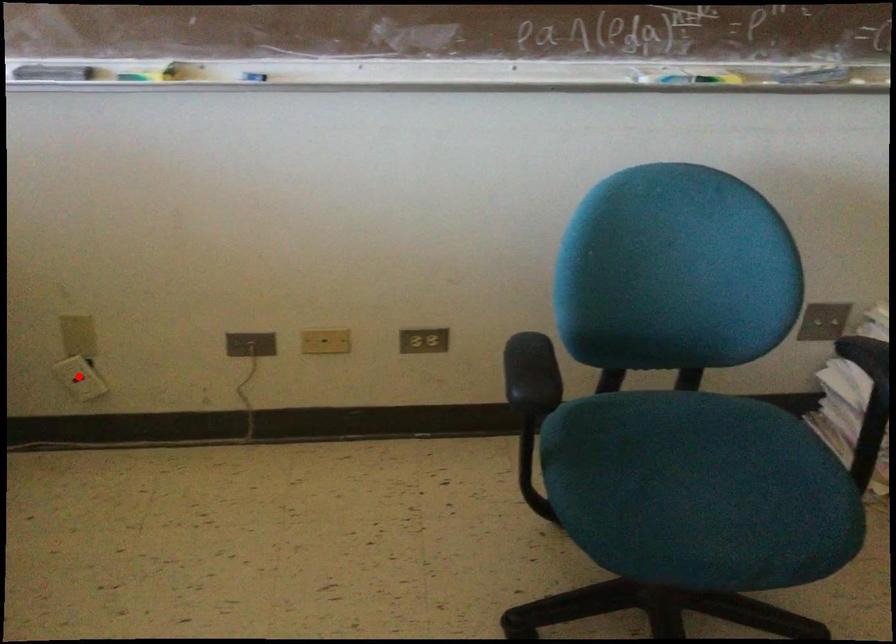
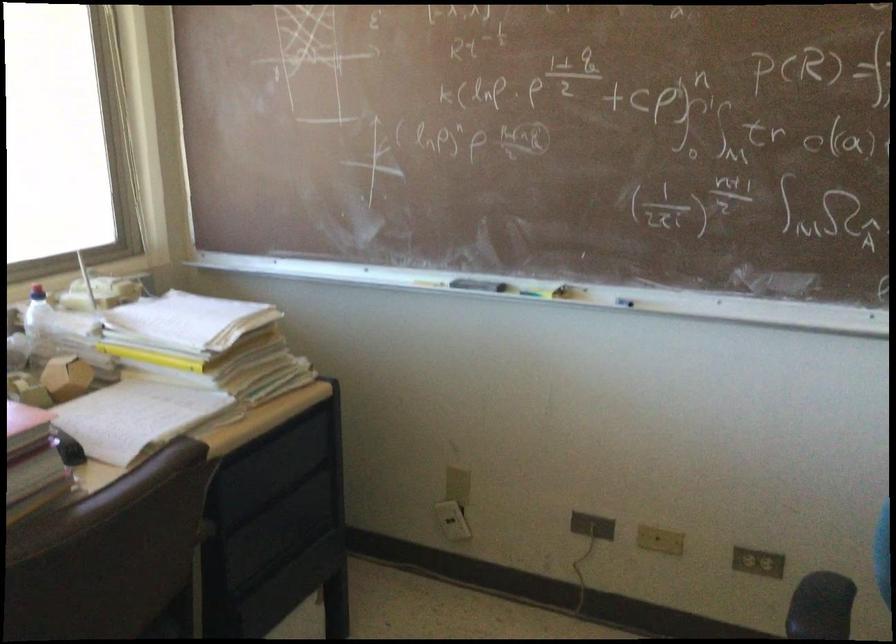
Question: I am providing you with two images of the same scene from different viewpoints. Given a red point in image1, look at the same physical point in image2. Is it:

Choices:
 (A) Closer to the viewpoint
 (B) Farther from the viewpoint

Answer: (B)